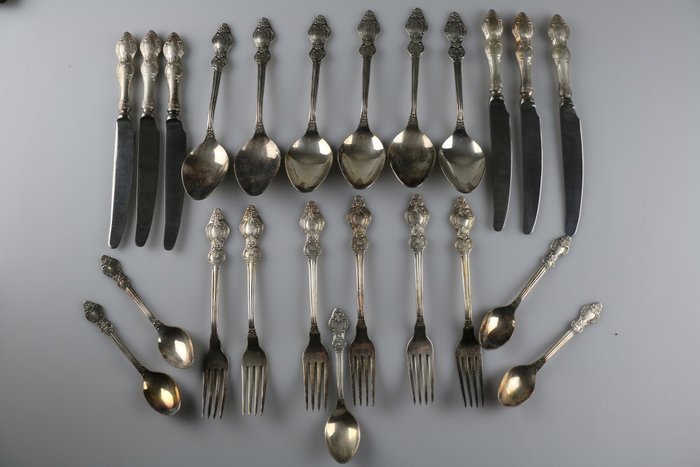
At what (x,y) coordinates should I click in order to perform the action: click on forks. Please return your answer as a coordinate pair (x, y). This screenshot has height=467, width=700. Looking at the image, I should click on (217, 362), (255, 369), (314, 362), (365, 355), (424, 355), (470, 362).